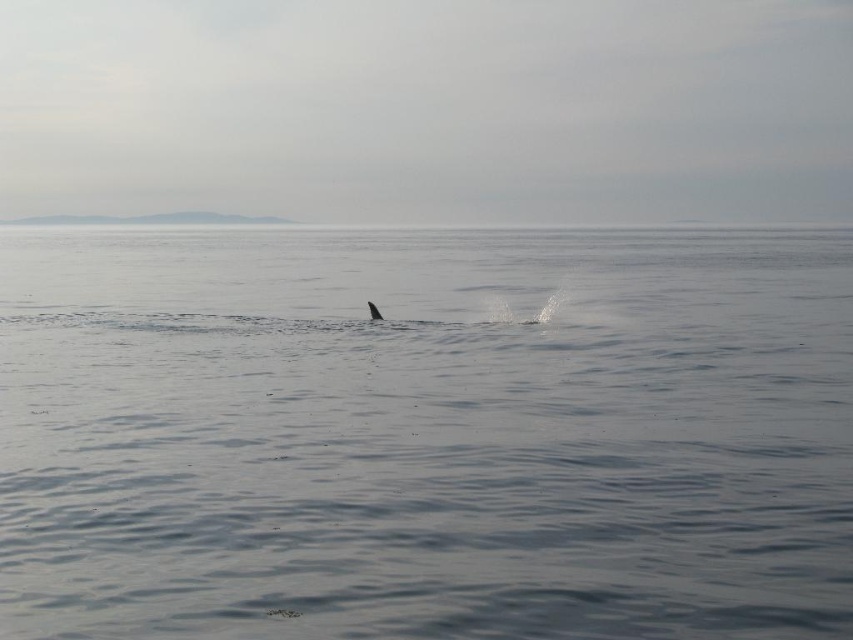
You are a marine biologist observing the seascape. You notice two points in the water at coordinates point (799, 268) and point (379, 312). Which point is closer to the horizon?

Point (379, 312) is closer to the horizon because it is in front of point (799, 268), which is behind it.

You are a marine biologist observing the seascape. You notice the clear water at center and the gray matte whale at center. Which object occupies a bigger area in the image?

The clear water at center has a larger size compared to the gray matte whale at center, so the clear water at center occupies a bigger area in the image.